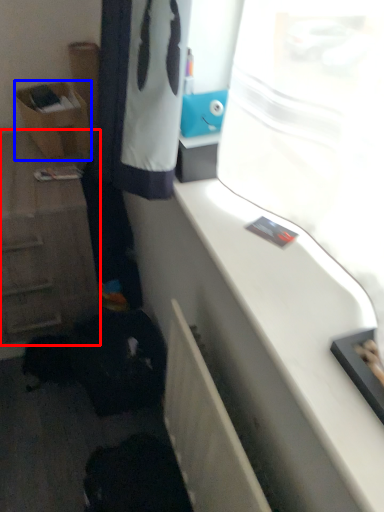
Question: Which object appears farthest to the camera in this image, cabinetry (highlighted by a red box) or shelf (highlighted by a blue box)?

Choices:
 (A) cabinetry
 (B) shelf

Answer: (B)